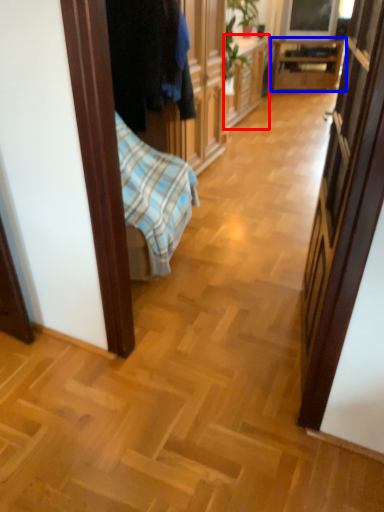
Question: Among these objects, which one is nearest to the camera, cabinetry (highlighted by a red box) or table (highlighted by a blue box)?

Choices:
 (A) cabinetry
 (B) table

Answer: (A)